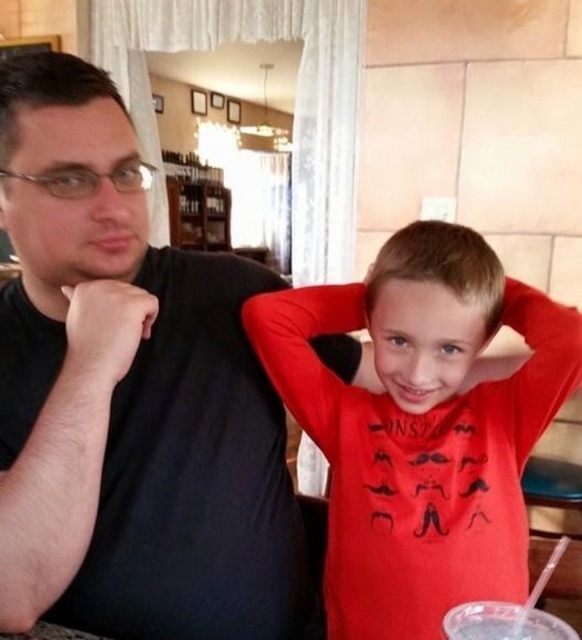
You are a photographer setting up a shot of the scene described. You need to ensure that the black matte shirt at left and the clear plastic cup at lower right are both in focus. Given their height difference, which object should you adjust your camera focus on first to account for depth of field?

The black matte shirt at left is much taller than the clear plastic cup at lower right. To account for depth of field, focus on the black matte shirt at left first since it is taller and likely farther away, ensuring both objects remain in focus.

You are a photographer setting up for a portrait. You notice the red matte shirt at right and the clear plastic cup at lower right. To ensure both subjects are in focus, which object should you adjust your camera focus to prioritize first?

The red matte shirt at right is located above the clear plastic cup at lower right, so you should prioritize focusing on the red matte shirt at right first as it is closer to the camera.